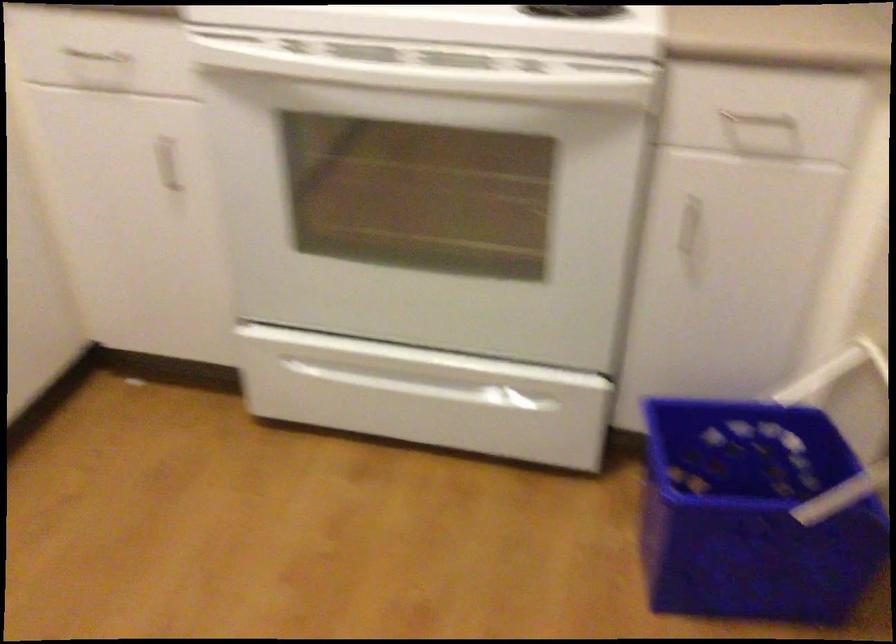
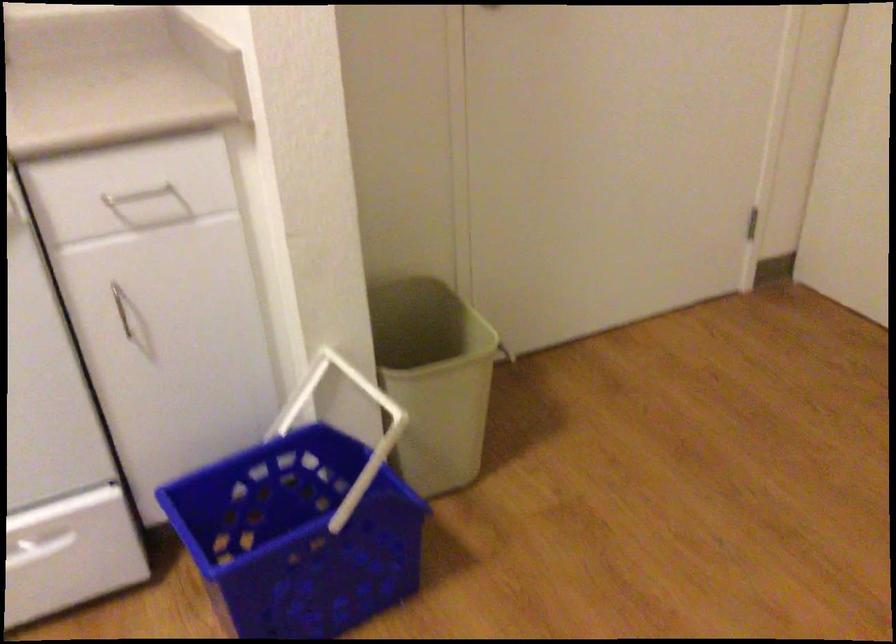
In the second image, find the point that corresponds to [682,218] in the first image.

(121, 307)